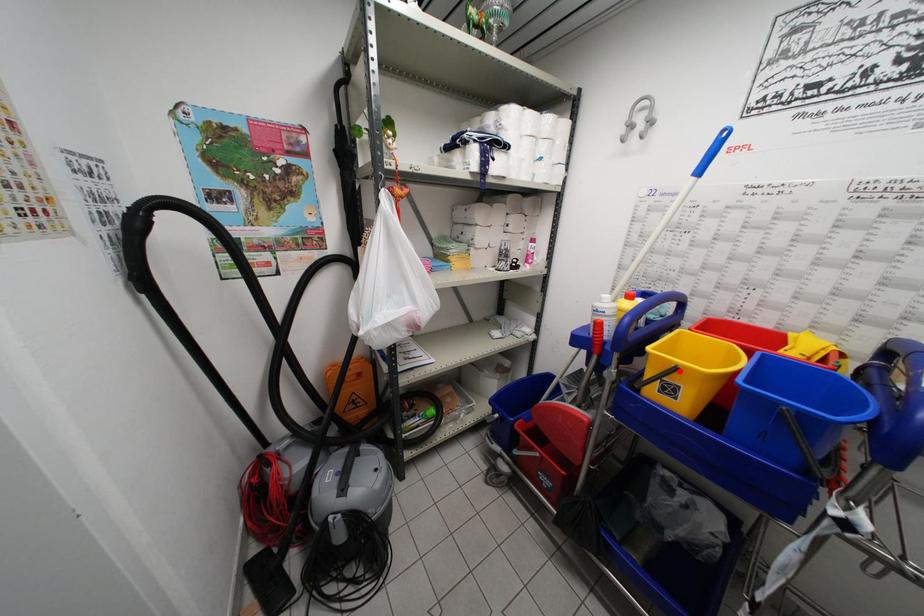
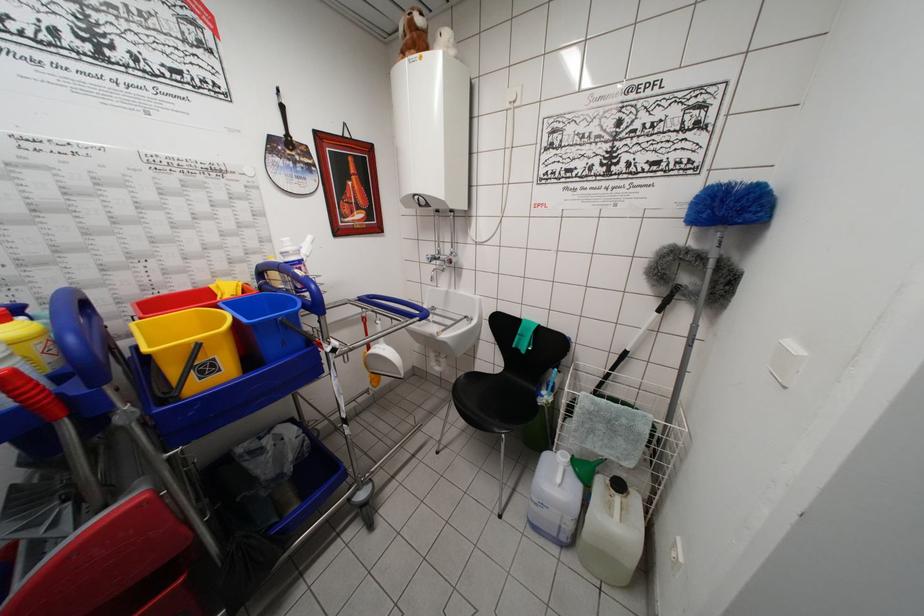
Find the pixel in the second image that matches the highlighted location in the first image.

(200, 349)